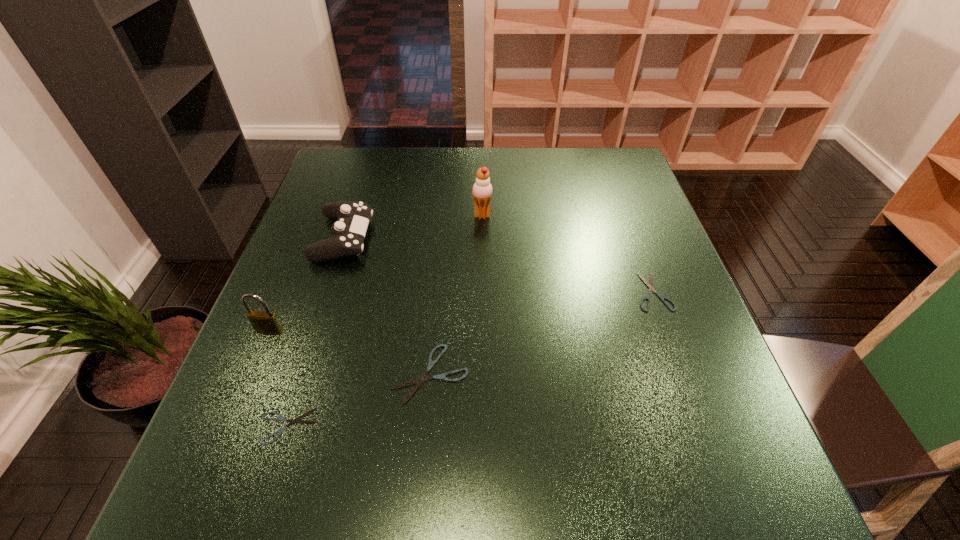
This screenshot has width=960, height=540. Identify the location of the nearest shears. (291, 421).

In order to click on the shortest shears in this screenshot , I will do `click(291, 421)`.

At what (x,y) coordinates should I click in order to perform the action: click on the fourth tallest object. Please return your answer as a coordinate pair (x, y). Image resolution: width=960 pixels, height=540 pixels. Looking at the image, I should click on (419, 381).

You are a GUI agent. You are given a task and a screenshot of the screen. Output one action in this format:
    pyautogui.click(x=<x>, y=<y>)
    Task: Click on the fourth object from left to right
    The image size is (960, 540).
    Given the screenshot: What is the action you would take?
    [419, 381]

This screenshot has width=960, height=540. I want to click on the fourth nearest object, so click(650, 286).

The width and height of the screenshot is (960, 540). In order to click on the rightmost object in this screenshot , I will do `click(650, 286)`.

The height and width of the screenshot is (540, 960). Identify the location of icecream. (482, 189).

You are a GUI agent. You are given a task and a screenshot of the screen. Output one action in this format:
    pyautogui.click(x=<x>, y=<y>)
    Task: Click on the fifth object from left to right
    The width and height of the screenshot is (960, 540).
    Given the screenshot: What is the action you would take?
    pyautogui.click(x=482, y=189)

At what (x,y) coordinates should I click in order to perform the action: click on the fourth shortest object. Please return your answer as a coordinate pair (x, y). The height and width of the screenshot is (540, 960). Looking at the image, I should click on (352, 217).

In order to click on padlock in this screenshot , I will do `click(266, 322)`.